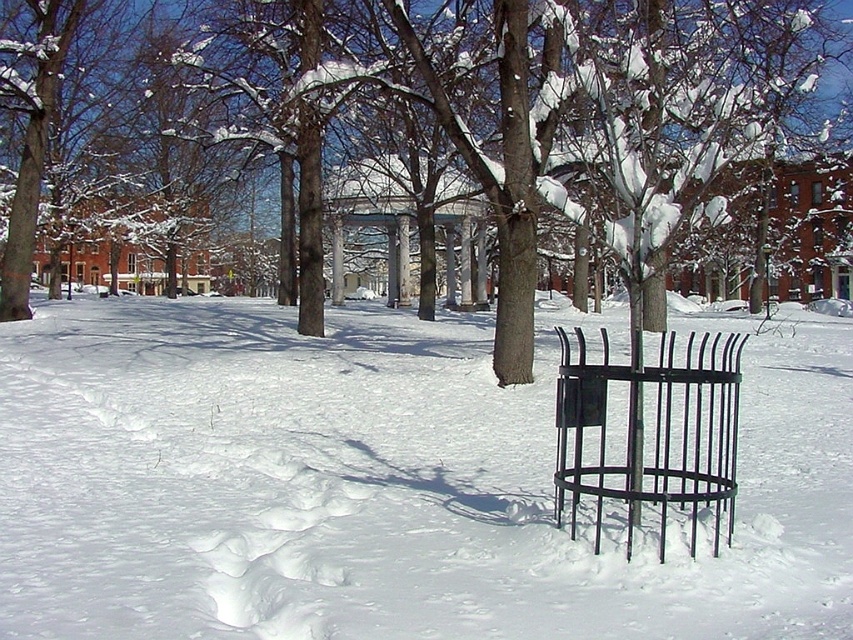
You are standing in the winter park scene and want to place a small snowman between the white matte snow at center and the black wrought iron trash can at center. According to their positions, which object should the snowman be closer to?

The white matte snow at center is positioned on the left side of black wrought iron trash can at center, so the snowman should be placed closer to the white matte snow at center to be between them.